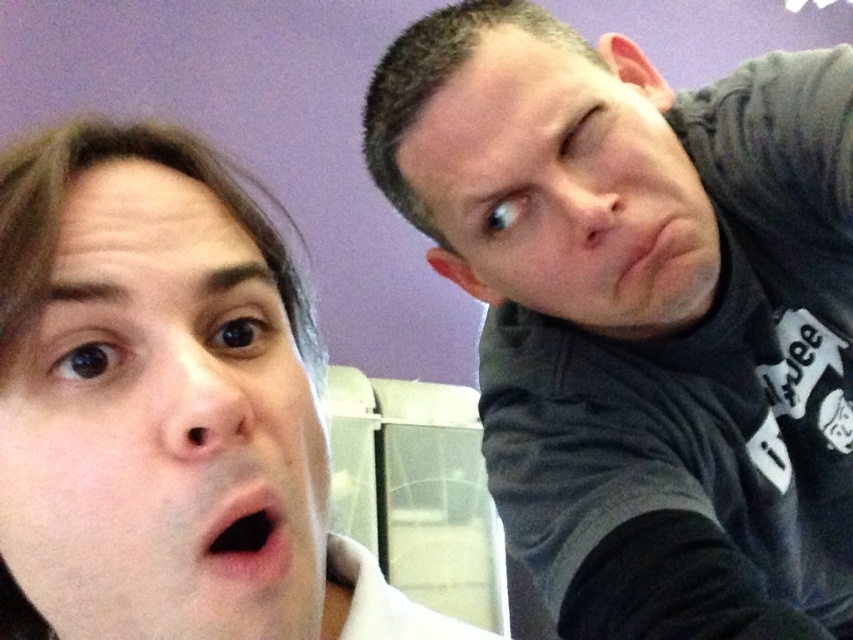
Can you confirm if matte skin at upper right is taller than pink flesh-colored mouth at lower left?

Yes.

Which is below, matte skin at upper right or pink flesh-colored mouth at lower left?

pink flesh-colored mouth at lower left is below.

Is point (630, 296) less distant than point (263, 502)?

No, it is not.

Where is `matte skin at upper right`? Image resolution: width=853 pixels, height=640 pixels. matte skin at upper right is located at coordinates (646, 248).

Can you confirm if smooth skin face at left is shorter than pink flesh-colored mouth at lower left?

No, smooth skin face at left is not shorter than pink flesh-colored mouth at lower left.

Between smooth skin face at left and pink flesh-colored mouth at lower left, which one has less height?

pink flesh-colored mouth at lower left is shorter.

Who is more distant from viewer, (253, 472) or (236, 552)?

The point (236, 552) is more distant.

Locate an element on the screen. The height and width of the screenshot is (640, 853). smooth skin face at left is located at coordinates (160, 426).

Which is in front, point (405, 180) or point (613, 218)?

Point (613, 218) is in front.

Is matte black face at upper right to the left of matte skin at upper right from the viewer's perspective?

No, matte black face at upper right is not to the left of matte skin at upper right.

Describe the element at coordinates (555, 177) in the screenshot. I see `matte black face at upper right` at that location.

At what (x,y) coordinates should I click in order to perform the action: click on matte black face at upper right. Please return your answer as a coordinate pair (x, y). Image resolution: width=853 pixels, height=640 pixels. Looking at the image, I should click on (555, 177).